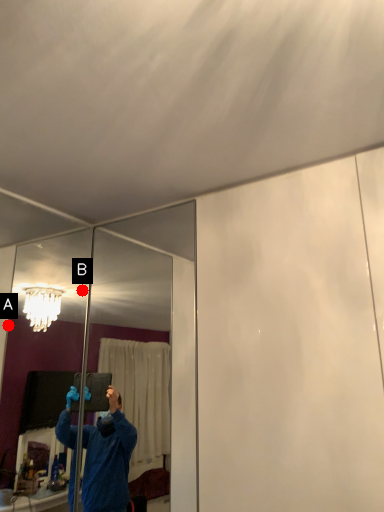
Question: Two points are circled on the image, labeled by A and B beside each circle. Which point is closer to the camera?

Choices:
 (A) A is closer
 (B) B is closer

Answer: (B)